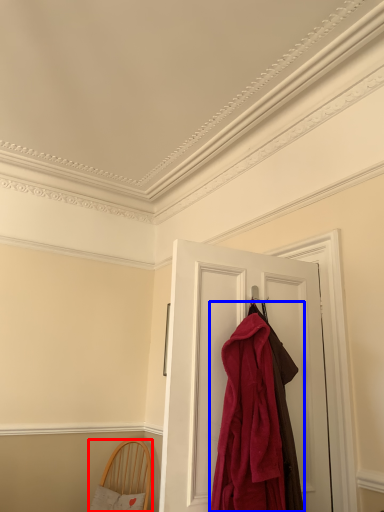
Question: Which object is closer to the camera taking this photo, furniture (highlighted by a red box) or cloak (highlighted by a blue box)?

Choices:
 (A) furniture
 (B) cloak

Answer: (B)